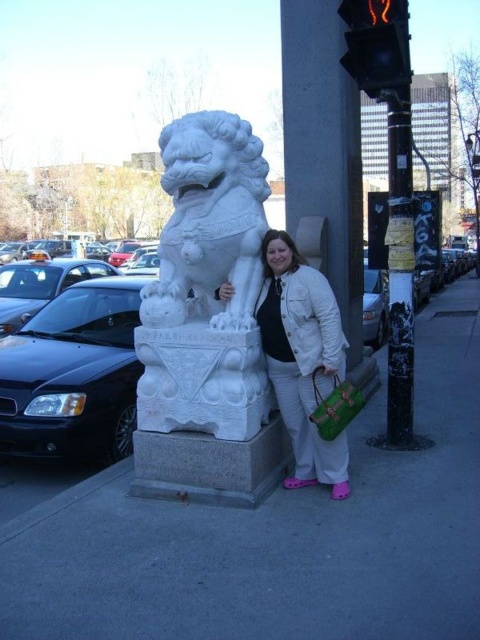
You are a photographer trying to capture a photo of the white stone statue at center and the brushed metal lamp post at upper right. From your current position, which object is closer to the left side of the frame?

The white stone statue at center is positioned on the left side of the brushed metal lamp post at upper right, so it is closer to the left side of the frame.

You are standing at the point labeled as point (277,534) in the image. Looking around, you see the white stone lion statue at center and the woman beside it. Which object is closer to your current position?

The point (277,534) is on the white stone lion statue at center, so the white stone lion statue at center is closer to your current position than the woman beside it.

Based on the scene description, where is the white stone pillar at center located in the image?

The white stone pillar at center is located at point (324,148).